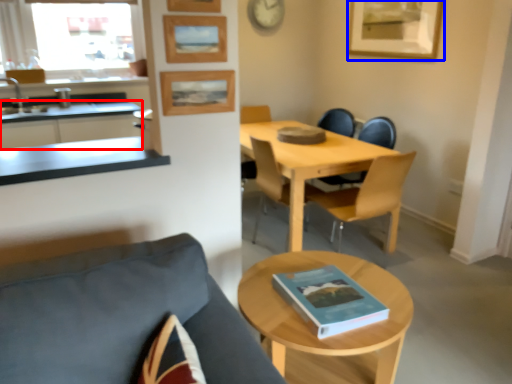
Question: Which object appears closest to the camera in this image, cabinetry (highlighted by a red box) or picture frame (highlighted by a blue box)?

Choices:
 (A) cabinetry
 (B) picture frame

Answer: (A)